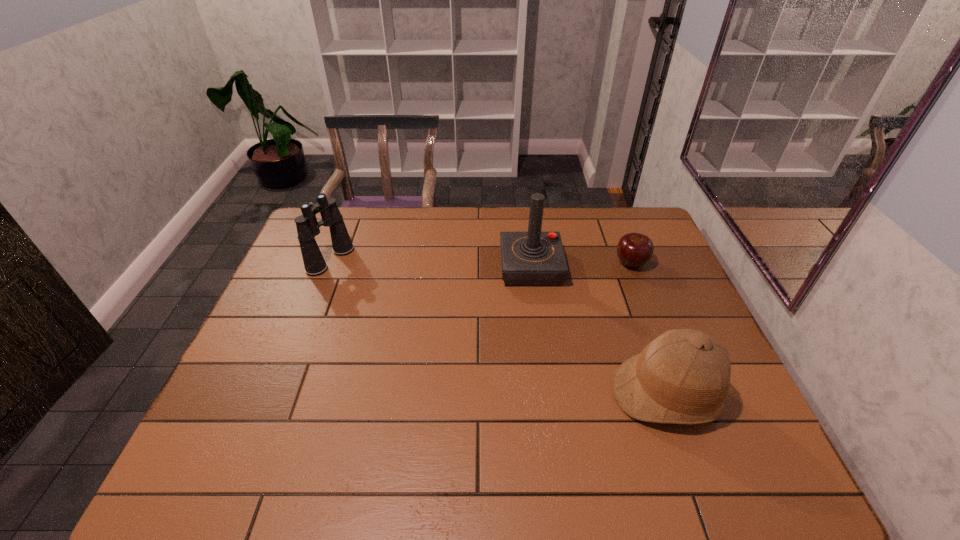
The width and height of the screenshot is (960, 540). What are the coordinates of `object that is the closest to the nearest object` in the screenshot? It's located at (534, 258).